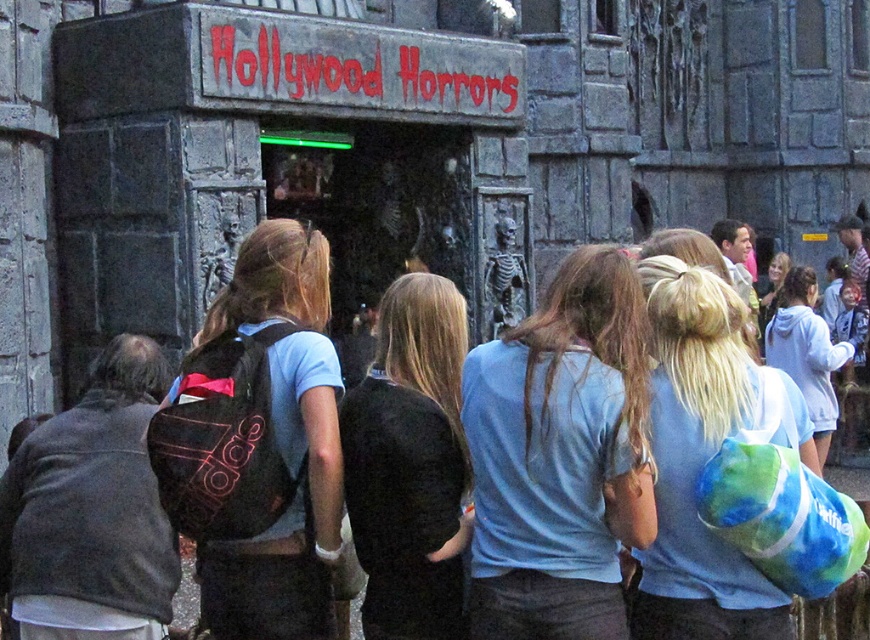
You are standing at the entrance of the Hollywood Horrors haunted house. You see a person wearing a blue cotton shirt at center. If you walk straight ahead, will you pass by this person before reaching the entrance?

The blue cotton shirt at center is located at coordinates point (560,458), which is in the center of the image. Since you are at the entrance, walking straight ahead would take you towards the center of the image where the person is standing. Therefore, you would pass by the person wearing the blue cotton shirt at center before reaching further into the attraction.